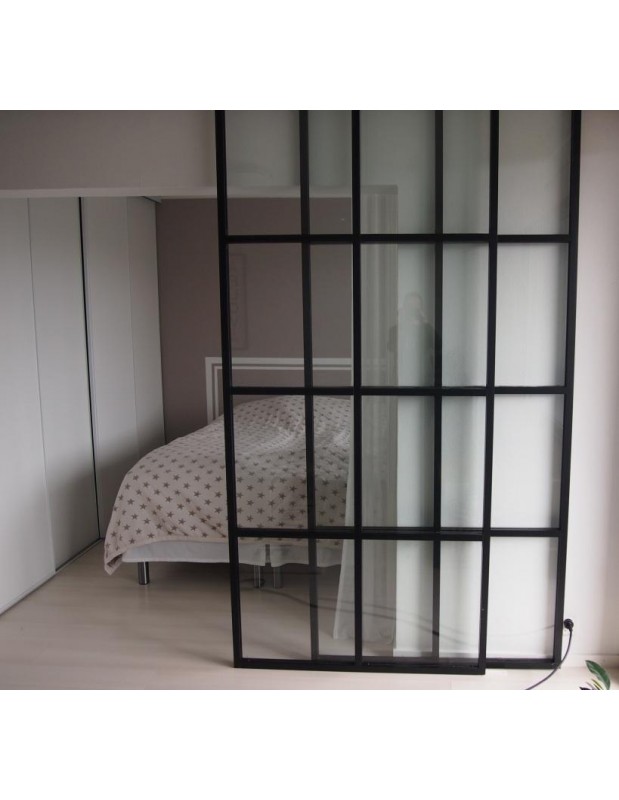
This screenshot has width=619, height=800. I want to click on duvet, so click(171, 486).